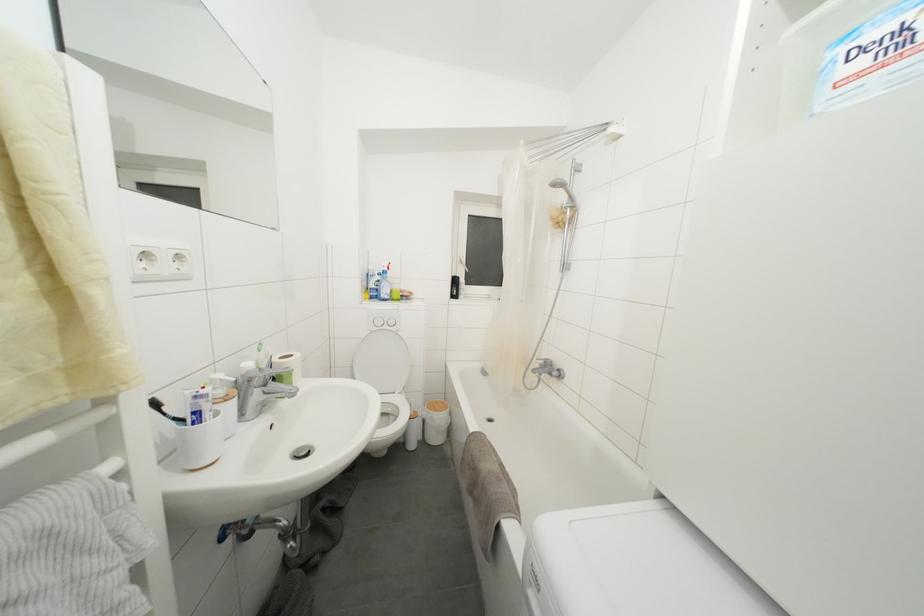
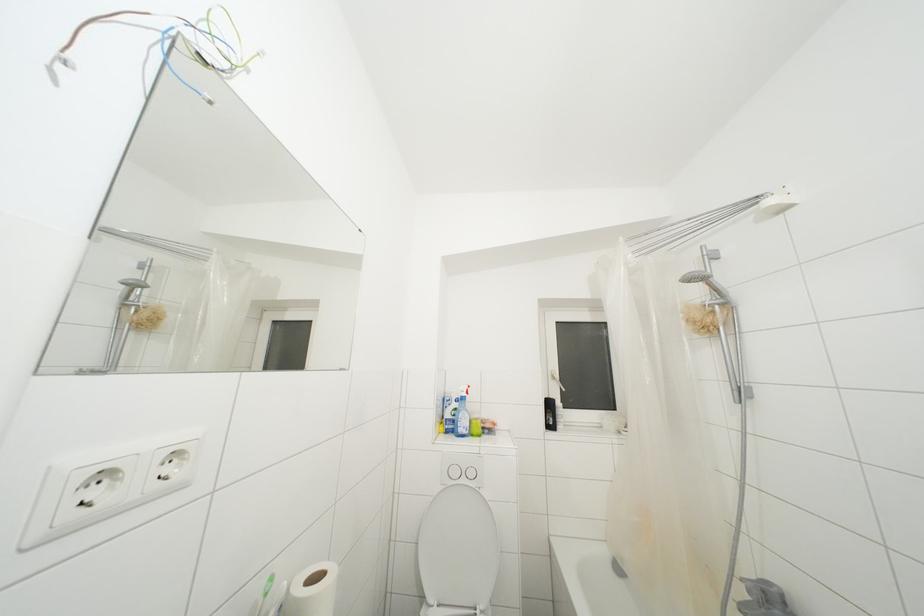
How did the camera likely rotate?

The camera rotated toward left-up.